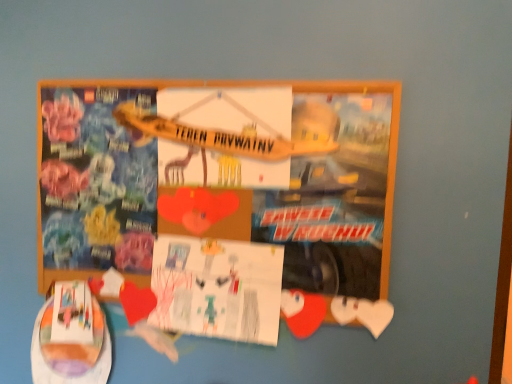
Identify the location of matte cardboard poster at center. (220, 201).

What do you see at coordinates (220, 201) in the screenshot? The image size is (512, 384). I see `matte cardboard poster at center` at bounding box center [220, 201].

Measure the distance between white paper at center and camera.

They are 35.84 inches apart.

Describe the element at coordinates (217, 288) in the screenshot. I see `white paper at center` at that location.

Find the location of `white paper at center`. white paper at center is located at coordinates (217, 288).

Identify the location of matte cardboard poster at center. (220, 201).

Considering the positions of objects matte cardboard poster at center and white paper at center in the image provided, who is more to the left, matte cardboard poster at center or white paper at center?

Positioned to the left is matte cardboard poster at center.

Between matte cardboard poster at center and white paper at center, which one is positioned in front?

matte cardboard poster at center is closer to the camera.

Is point (54, 163) closer to viewer compared to point (248, 316)?

No, (54, 163) is behind (248, 316).

From the image's perspective, is matte cardboard poster at center located above or below white paper at center?

matte cardboard poster at center is above white paper at center.

From a real-world perspective, is matte cardboard poster at center on top of white paper at center?

A: Yes, from a real-world perspective, matte cardboard poster at center is on top of white paper at center.

Does matte cardboard poster at center have a greater width compared to white paper at center?

Correct, the width of matte cardboard poster at center exceeds that of white paper at center.

Considering the relative sizes of matte cardboard poster at center and white paper at center in the image provided, is matte cardboard poster at center shorter than white paper at center?

In fact, matte cardboard poster at center may be taller than white paper at center.

Does matte cardboard poster at center have a smaller size compared to white paper at center?

Actually, matte cardboard poster at center might be larger than white paper at center.

Is matte cardboard poster at center situated inside white paper at center or outside?

matte cardboard poster at center is located beyond the bounds of white paper at center.

Does matte cardboard poster at center touch white paper at center?

matte cardboard poster at center and white paper at center are clearly separated.

Could you tell me if matte cardboard poster at center is turned towards white paper at center?

Yes, matte cardboard poster at center is facing white paper at center.

Can you tell me how much matte cardboard poster at center and white paper at center differ in facing direction?

0.00334 degrees.

Identify the location of poster above the white paper at center (from the image's perspective). The image size is (512, 384). (220, 201).

Is white paper at center to the right of matte cardboard poster at center from the viewer's perspective?

Correct, you'll find white paper at center to the right of matte cardboard poster at center.

Is white paper at center further to camera compared to matte cardboard poster at center?

Yes.

Is point (268, 312) closer to viewer compared to point (77, 206)?

Yes.

From the image's perspective, is white paper at center located above or below matte cardboard poster at center?

From the image's perspective, white paper at center appears below matte cardboard poster at center.

From a real-world perspective, relative to matte cardboard poster at center, is white paper at center vertically above or below?

From a real-world perspective, white paper at center is physically below matte cardboard poster at center.

Considering the relative sizes of white paper at center and matte cardboard poster at center in the image provided, is white paper at center wider than matte cardboard poster at center?

In fact, white paper at center might be narrower than matte cardboard poster at center.

Can you confirm if white paper at center is taller than matte cardboard poster at center?

Incorrect, the height of white paper at center is not larger of that of matte cardboard poster at center.

Considering the sizes of objects white paper at center and matte cardboard poster at center in the image provided, who is bigger, white paper at center or matte cardboard poster at center?

With larger size is matte cardboard poster at center.

Can we say white paper at center lies outside matte cardboard poster at center?

Actually, white paper at center is at least partially inside matte cardboard poster at center.

Is white paper at center next to matte cardboard poster at center and touching it?

There is a gap between white paper at center and matte cardboard poster at center.

Is matte cardboard poster at center at the back of white paper at center?

Yes, white paper at center is positioned with its back facing matte cardboard poster at center.

The width and height of the screenshot is (512, 384). Identify the location of poster on the left side of white paper at center. (220, 201).

I want to click on flyer lying behind the matte cardboard poster at center, so click(217, 288).

Image resolution: width=512 pixels, height=384 pixels. What are the coordinates of `poster in front of the white paper at center` in the screenshot? It's located at (220, 201).